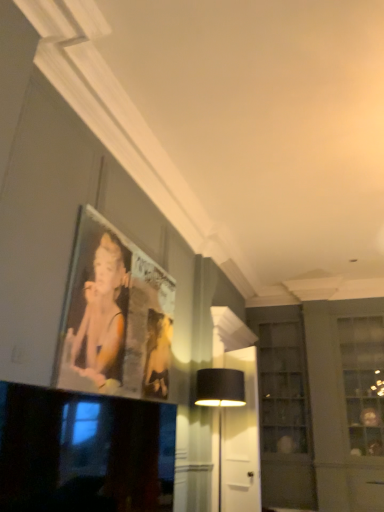
Question: Is black glossy television at lower left not close to clear glass cabinet at center right?

Choices:
 (A) no
 (B) yes

Answer: (B)

Question: From a real-world perspective, is black glossy television at lower left over clear glass cabinet at center right?

Choices:
 (A) no
 (B) yes

Answer: (A)

Question: From the image's perspective, is black glossy television at lower left beneath clear glass cabinet at center right?

Choices:
 (A) no
 (B) yes

Answer: (A)

Question: Does black glossy television at lower left have a greater height compared to clear glass cabinet at center right?

Choices:
 (A) yes
 (B) no

Answer: (B)

Question: Considering the relative sizes of black glossy television at lower left and clear glass cabinet at center right in the image provided, is black glossy television at lower left bigger than clear glass cabinet at center right?

Choices:
 (A) yes
 (B) no

Answer: (B)

Question: Is black glossy television at lower left oriented away from clear glass cabinet at center right?

Choices:
 (A) no
 (B) yes

Answer: (A)

Question: From a real-world perspective, is black fabric table lamp at center on top of clear glass cabinet at center right?

Choices:
 (A) no
 (B) yes

Answer: (A)

Question: Is black fabric table lamp at center outside clear glass cabinet at center right?

Choices:
 (A) no
 (B) yes

Answer: (B)

Question: Could you tell me if black fabric table lamp at center is turned towards clear glass cabinet at center right?

Choices:
 (A) no
 (B) yes

Answer: (A)

Question: Considering the relative positions of black fabric table lamp at center and clear glass cabinet at center right in the image provided, is black fabric table lamp at center behind clear glass cabinet at center right?

Choices:
 (A) yes
 (B) no

Answer: (B)

Question: Does black fabric table lamp at center appear on the left side of clear glass cabinet at center right?

Choices:
 (A) yes
 (B) no

Answer: (A)

Question: Is black fabric table lamp at center wider than clear glass cabinet at center right?

Choices:
 (A) no
 (B) yes

Answer: (B)

Question: Is clear glass cabinet at center right with black glossy television at lower left?

Choices:
 (A) no
 (B) yes

Answer: (A)